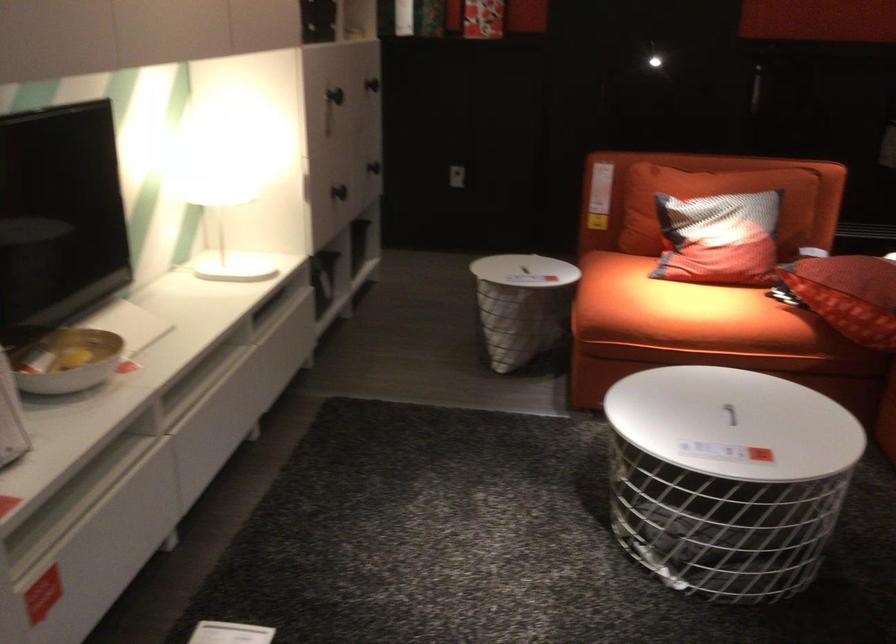
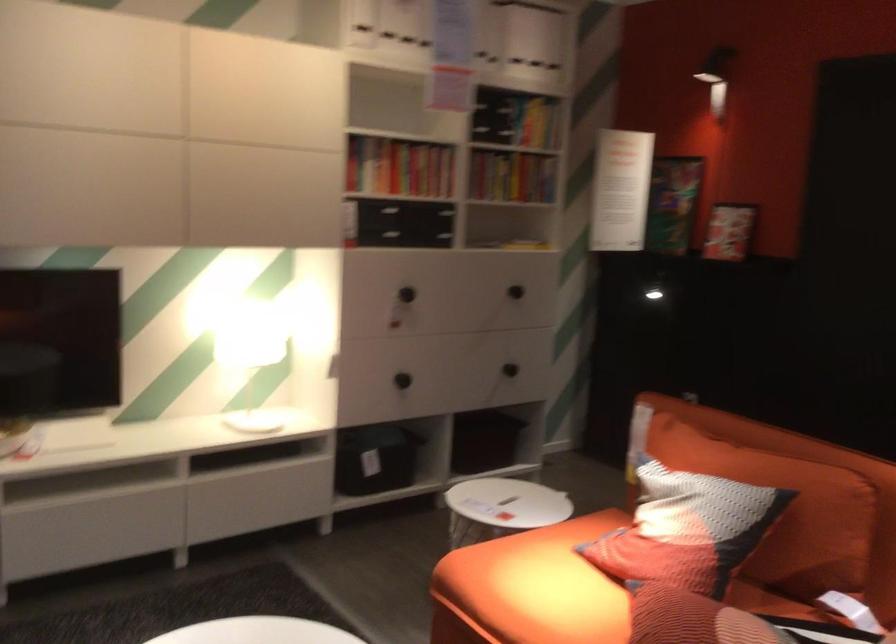
Find the pixel in the second image that matches the point at 329,287 in the first image.

(375, 459)